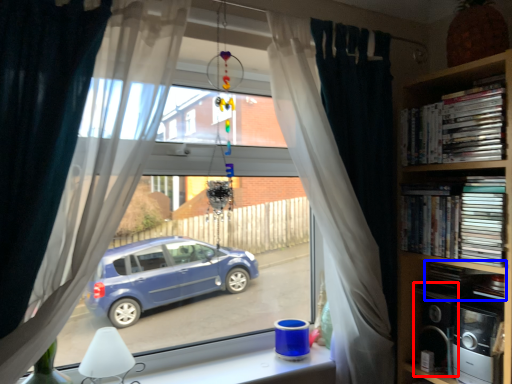
Question: Which of the following is the closest to the observer, appliance (highlighted by a red box) or book (highlighted by a blue box)?

Choices:
 (A) appliance
 (B) book

Answer: (B)